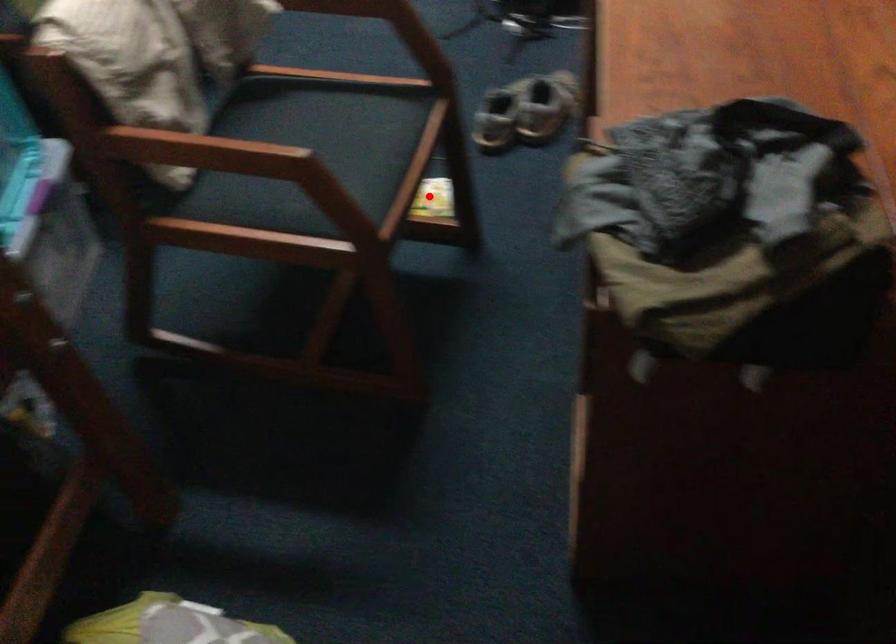
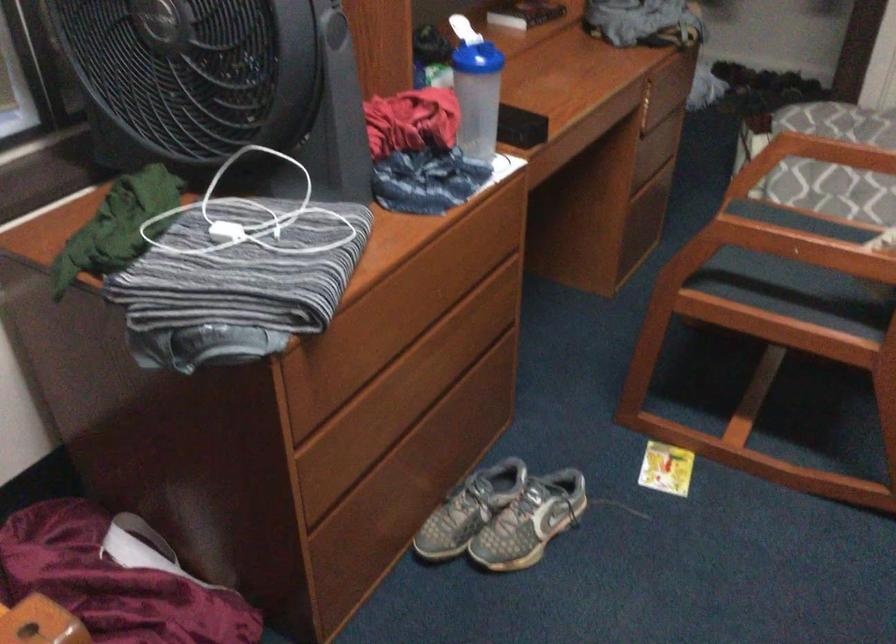
Find the pixel in the second image that matches the highlighted location in the first image.

(666, 468)